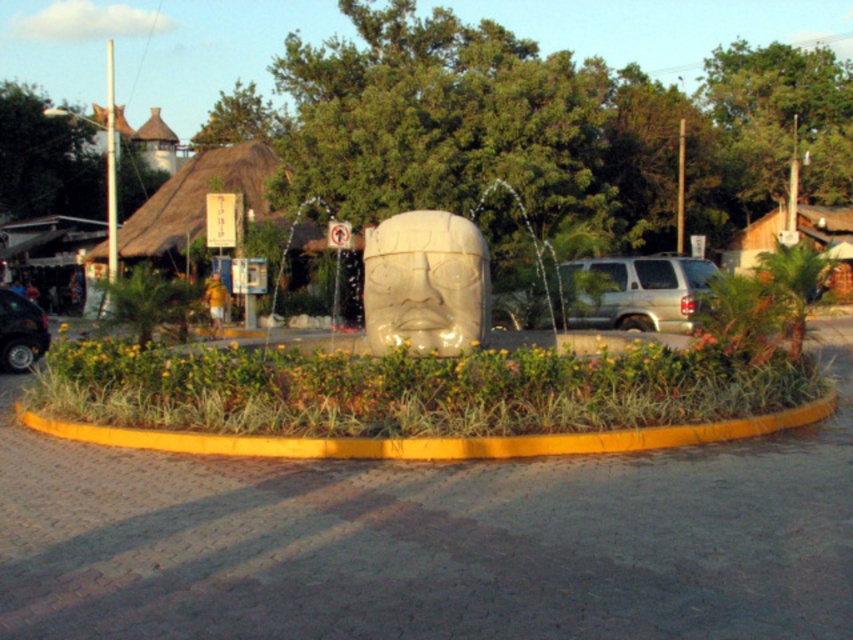
You are a pedestrian standing at the center of the roundabout near the stone sculpture. You want to cross to the sidewalk on the opposite side. Which vehicle, the silver metallic suv at right or the shiny black car at lower left, is closer to your path?

The shiny black car at lower left is closer to your path because the silver metallic suv at right is to the right of it, meaning the shiny black car is positioned between you and the sidewalk.

You are driving a car that is 2 meters wide and want to park it near the roundabout. The yellow painted curb at lower center and the silver metallic suv at right are in your way. Which object is narrower and can be passed through to park?

The yellow painted curb at lower center has a lesser width compared to the silver metallic suv at right, so you can pass through the yellow painted curb at lower center since it is narrower than the car.

You are a driver approaching the roundabout and see the shiny black car at lower left and the yellow painted curb at lower center. Which object is closer to you as you enter the roundabout?

The shiny black car at lower left is closer to you than the yellow painted curb at lower center because the yellow painted curb at lower center is positioned under the shiny black car at lower left, indicating it is further back in the scene.